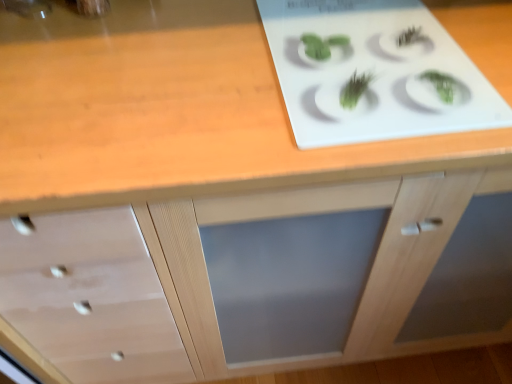
Where is `white matte book cover at upper right`? The image size is (512, 384). white matte book cover at upper right is located at coordinates (373, 72).

Describe the element at coordinates (373, 72) in the screenshot. I see `white matte book cover at upper right` at that location.

At what (x,y) coordinates should I click in order to perform the action: click on white matte book cover at upper right. Please return your answer as a coordinate pair (x, y). Image resolution: width=512 pixels, height=384 pixels. Looking at the image, I should click on (373, 72).